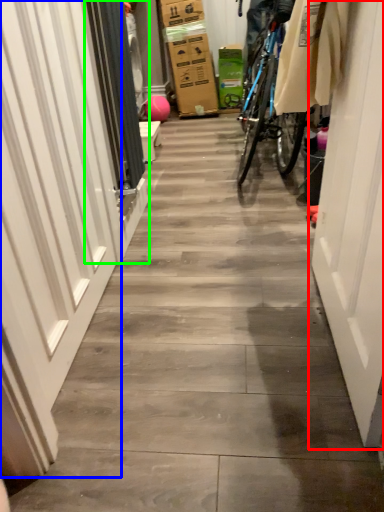
Question: Which is nearer to the door (highlighted by a red box)? garage door (highlighted by a blue box) or screen door (highlighted by a green box).

Choices:
 (A) garage door
 (B) screen door

Answer: (A)